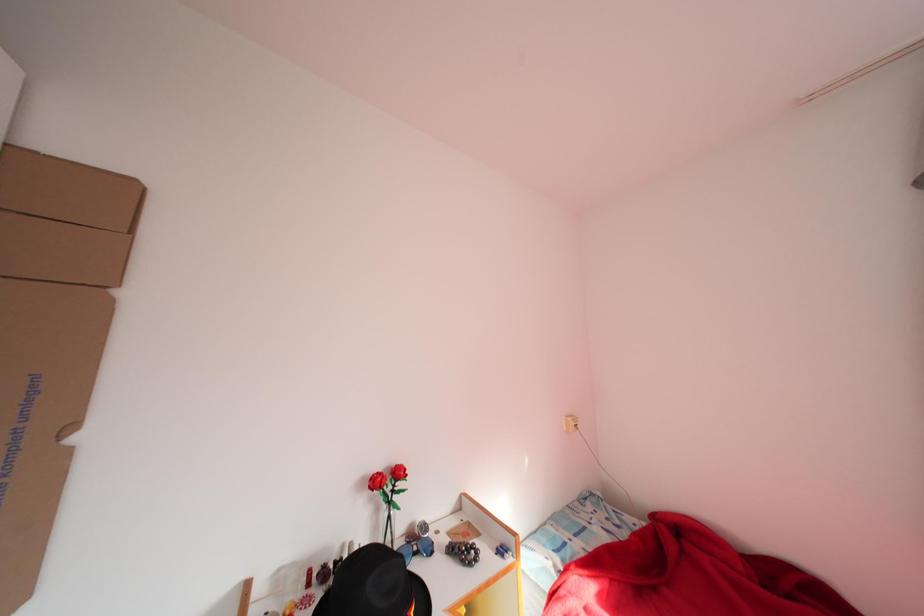
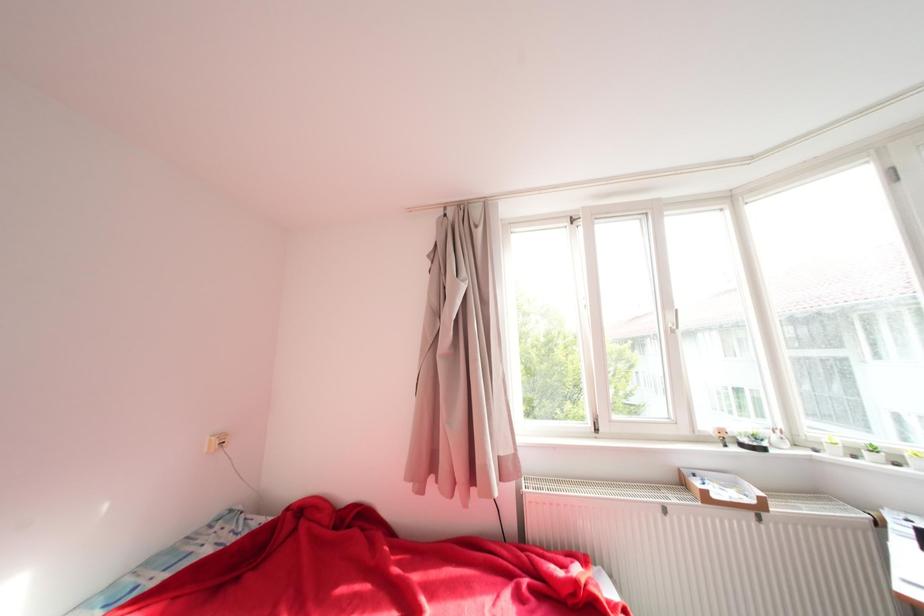
Question: Based on the continuous images, in which direction is the camera rotating? Reply with the corresponding letter.

Choices:
 (A) Left
 (B) Right
 (C) Up
 (D) Down

Answer: (B)